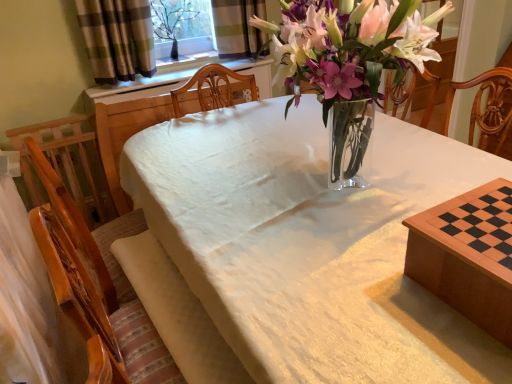
Describe the element at coordinates (117, 38) in the screenshot. I see `plaid fabric curtain at upper left` at that location.

Image resolution: width=512 pixels, height=384 pixels. What are the coordinates of `wooden chessboard at lower right, the 2th table in the front-to-back sequence` in the screenshot? It's located at (461, 267).

I want to click on plaid fabric curtain at upper left, so click(117, 38).

From a real-world perspective, is white cloth at center, which appears as the second table when viewed from the back, physically below plaid fabric curtain at upper left?

Yes, from a real-world perspective, white cloth at center, which appears as the second table when viewed from the back, is under plaid fabric curtain at upper left.

Does white cloth at center, which appears as the second table when viewed from the back, turn towards plaid fabric curtain at upper left?

No, white cloth at center, which appears as the second table when viewed from the back, does not turn towards plaid fabric curtain at upper left.

Between point (208, 185) and point (144, 63), which one is positioned behind?

Positioned behind is point (144, 63).

Which object is positioned more to the left, white cloth at center, which appears as the second table when viewed from the back, or plaid fabric curtain at upper left?

From the viewer's perspective, plaid fabric curtain at upper left appears more on the left side.

Which object is more forward, white cloth at center, the first table when ordered from front to back, or wooden chessboard at lower right, the 2th table in the front-to-back sequence?

white cloth at center, the first table when ordered from front to back.

From a real-world perspective, is white cloth at center, the first table when ordered from front to back, below wooden chessboard at lower right, the 1th table positioned from the back?

Yes, from a real-world perspective, white cloth at center, the first table when ordered from front to back, is beneath wooden chessboard at lower right, the 1th table positioned from the back.

In the scene shown: Could you tell me if white cloth at center, which appears as the second table when viewed from the back, is turned towards wooden chessboard at lower right, the 2th table in the front-to-back sequence?

No, white cloth at center, which appears as the second table when viewed from the back, does not turn towards wooden chessboard at lower right, the 2th table in the front-to-back sequence.

Considering the sizes of white cloth at center, which appears as the second table when viewed from the back, and wooden chessboard at lower right, the 2th table in the front-to-back sequence, in the image, is white cloth at center, which appears as the second table when viewed from the back, wider or thinner than wooden chessboard at lower right, the 2th table in the front-to-back sequence,?

white cloth at center, which appears as the second table when viewed from the back, is wider than wooden chessboard at lower right, the 2th table in the front-to-back sequence.

Is plaid fabric curtain at upper left next to white cloth at center, the first table when ordered from front to back, and touching it?

No, plaid fabric curtain at upper left is not making contact with white cloth at center, the first table when ordered from front to back.

Would you say plaid fabric curtain at upper left is inside or outside white cloth at center, which appears as the second table when viewed from the back?

The correct answer is: outside.

Can you confirm if plaid fabric curtain at upper left is positioned to the left of white cloth at center, the first table when ordered from front to back?

Correct, you'll find plaid fabric curtain at upper left to the left of white cloth at center, the first table when ordered from front to back.

Can you confirm if plaid fabric curtain at upper left is taller than white cloth at center, which appears as the second table when viewed from the back?

No.

Considering the positions of objects plaid fabric curtain at upper left and wooden chessboard at lower right, the 1th table positioned from the back, in the image provided, who is more to the right, plaid fabric curtain at upper left or wooden chessboard at lower right, the 1th table positioned from the back,?

From the viewer's perspective, wooden chessboard at lower right, the 1th table positioned from the back, appears more on the right side.

Can you confirm if plaid fabric curtain at upper left is taller than wooden chessboard at lower right, the 2th table in the front-to-back sequence?

Indeed, plaid fabric curtain at upper left has a greater height compared to wooden chessboard at lower right, the 2th table in the front-to-back sequence.

Considering their positions, is plaid fabric curtain at upper left located in front of or behind wooden chessboard at lower right, the 1th table positioned from the back?

In the image, plaid fabric curtain at upper left appears behind wooden chessboard at lower right, the 1th table positioned from the back.

How many degrees apart are the facing directions of plaid fabric curtain at upper left and wooden chessboard at lower right, the 1th table positioned from the back?

89.9 degrees separate the facing orientations of plaid fabric curtain at upper left and wooden chessboard at lower right, the 1th table positioned from the back.

Locate an element on the screen. This screenshot has height=384, width=512. window screen behind the plaid fabric curtain at upper left is located at coordinates (181, 27).

Are plaid fabric curtain at upper left and clear glass vase at upper center beside each other?

No, plaid fabric curtain at upper left is not with clear glass vase at upper center.

Is point (97, 33) farther from viewer compared to point (163, 16)?

No, it is not.

In the image, is plaid fabric curtain at upper left positioned in front of or behind clear glass vase at upper center?

plaid fabric curtain at upper left is in front of clear glass vase at upper center.

Which is more to the right, wooden chessboard at lower right, the 1th table positioned from the back, or plaid fabric curtain at upper left?

wooden chessboard at lower right, the 1th table positioned from the back.

Can you confirm if wooden chessboard at lower right, the 2th table in the front-to-back sequence, is thinner than plaid fabric curtain at upper left?

In fact, wooden chessboard at lower right, the 2th table in the front-to-back sequence, might be wider than plaid fabric curtain at upper left.

Is wooden chessboard at lower right, the 1th table positioned from the back, directly adjacent to plaid fabric curtain at upper left?

wooden chessboard at lower right, the 1th table positioned from the back, and plaid fabric curtain at upper left are clearly separated.

Considering the relative sizes of clear glass vase at upper center and wooden chessboard at lower right, the 1th table positioned from the back, in the image provided, is clear glass vase at upper center bigger than wooden chessboard at lower right, the 1th table positioned from the back,?

Yes, clear glass vase at upper center is bigger than wooden chessboard at lower right, the 1th table positioned from the back.

Which of these two, clear glass vase at upper center or wooden chessboard at lower right, the 2th table in the front-to-back sequence, stands shorter?

Standing shorter between the two is wooden chessboard at lower right, the 2th table in the front-to-back sequence.

Considering the positions of objects clear glass vase at upper center and wooden chessboard at lower right, the 1th table positioned from the back, in the image provided, who is in front, clear glass vase at upper center or wooden chessboard at lower right, the 1th table positioned from the back,?

Positioned in front is wooden chessboard at lower right, the 1th table positioned from the back.

From the image's perspective, relative to wooden chessboard at lower right, the 2th table in the front-to-back sequence, is clear glass vase at upper center above or below?

clear glass vase at upper center is above wooden chessboard at lower right, the 2th table in the front-to-back sequence.

Where is `the 1st table to the right when counting from the plaid fabric curtain at upper left`? the 1st table to the right when counting from the plaid fabric curtain at upper left is located at coordinates (297, 233).

Find the location of a particular element. table to the left of wooden chessboard at lower right, the 2th table in the front-to-back sequence is located at coordinates (297, 233).

Which object lies further to the anchor point wooden chessboard at lower right, the 1th table positioned from the back, plaid fabric curtain at upper left or white cloth at center, which appears as the second table when viewed from the back?

plaid fabric curtain at upper left is further to wooden chessboard at lower right, the 1th table positioned from the back.

Based on their spatial positions, is plaid fabric curtain at upper left or wooden chessboard at lower right, the 1th table positioned from the back, closer to clear glass vase at upper center?

plaid fabric curtain at upper left is closer to clear glass vase at upper center.

From the image, which object appears to be farther from wooden chessboard at lower right, the 2th table in the front-to-back sequence, white cloth at center, the first table when ordered from front to back, or clear glass vase at upper center?

Among the two, clear glass vase at upper center is located further to wooden chessboard at lower right, the 2th table in the front-to-back sequence.

When comparing their distances from plaid fabric curtain at upper left, does wooden chessboard at lower right, the 1th table positioned from the back, or white cloth at center, the first table when ordered from front to back, seem closer?

Based on the image, white cloth at center, the first table when ordered from front to back, appears to be nearer to plaid fabric curtain at upper left.

When comparing their distances from white cloth at center, which appears as the second table when viewed from the back, does clear glass vase at upper center or plaid fabric curtain at upper left seem closer?

Based on the image, plaid fabric curtain at upper left appears to be nearer to white cloth at center, which appears as the second table when viewed from the back.

From the image, which object appears to be farther from white cloth at center, the first table when ordered from front to back, clear glass vase at upper center or wooden chessboard at lower right, the 2th table in the front-to-back sequence?

Based on the image, clear glass vase at upper center appears to be further to white cloth at center, the first table when ordered from front to back.

From the picture: From the image, which object appears to be nearer to clear glass vase at upper center, white cloth at center, which appears as the second table when viewed from the back, or wooden chessboard at lower right, the 1th table positioned from the back?

Among the two, white cloth at center, which appears as the second table when viewed from the back, is located nearer to clear glass vase at upper center.

Considering their positions, is wooden chessboard at lower right, the 1th table positioned from the back, positioned further to white cloth at center, which appears as the second table when viewed from the back, than plaid fabric curtain at upper left?

plaid fabric curtain at upper left is further to white cloth at center, which appears as the second table when viewed from the back.

Identify the location of table located between white cloth at center, which appears as the second table when viewed from the back, and clear glass vase at upper center in the depth direction. (461, 267).

Image resolution: width=512 pixels, height=384 pixels. Identify the location of curtain between wooden chessboard at lower right, the 2th table in the front-to-back sequence, and clear glass vase at upper center, along the z-axis. (117, 38).

Find the location of a particular element. Image resolution: width=512 pixels, height=384 pixels. curtain between white cloth at center, which appears as the second table when viewed from the back, and clear glass vase at upper center, along the z-axis is located at coordinates (117, 38).

The width and height of the screenshot is (512, 384). Find the location of `table between white cloth at center, the first table when ordered from front to back, and plaid fabric curtain at upper left, along the z-axis`. table between white cloth at center, the first table when ordered from front to back, and plaid fabric curtain at upper left, along the z-axis is located at coordinates coord(461,267).